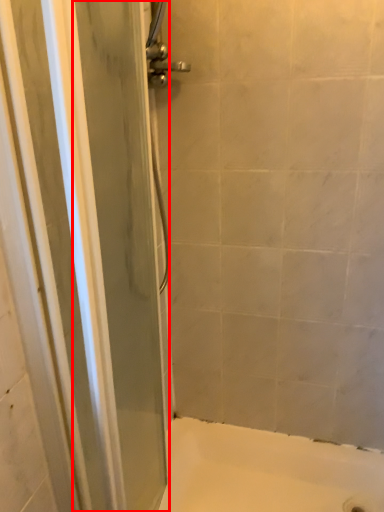
Question: From the image's perspective, what is the correct spatial relationship of screen door (annotated by the red box) in relation to bath?

Choices:
 (A) below
 (B) above

Answer: (B)